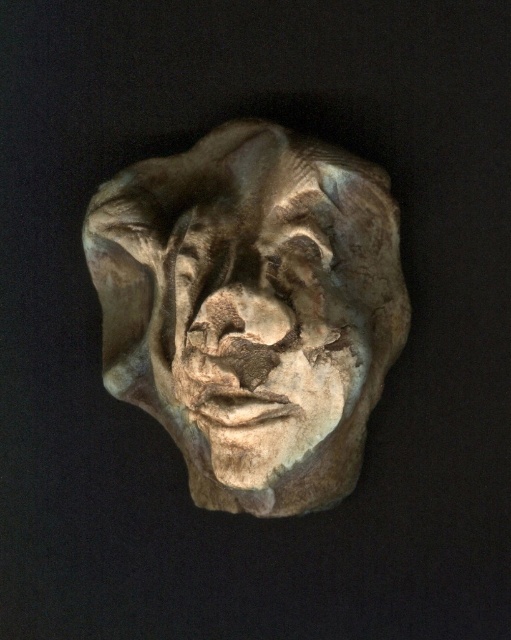
Question: Does matte stone face at center appear under rustic stone face at center?

Choices:
 (A) no
 (B) yes

Answer: (A)

Question: Which point is closer to the camera?

Choices:
 (A) (307, 497)
 (B) (263, 285)

Answer: (B)

Question: In this image, where is matte stone face at center located relative to rustic stone face at center?

Choices:
 (A) left
 (B) right

Answer: (A)

Question: Among these objects, which one is nearest to the camera?

Choices:
 (A) rustic stone face at center
 (B) matte stone face at center

Answer: (A)

Question: In this image, where is matte stone face at center located relative to rustic stone face at center?

Choices:
 (A) left
 (B) right

Answer: (A)

Question: Which object appears closest to the camera in this image?

Choices:
 (A) rustic stone face at center
 (B) matte stone face at center

Answer: (A)